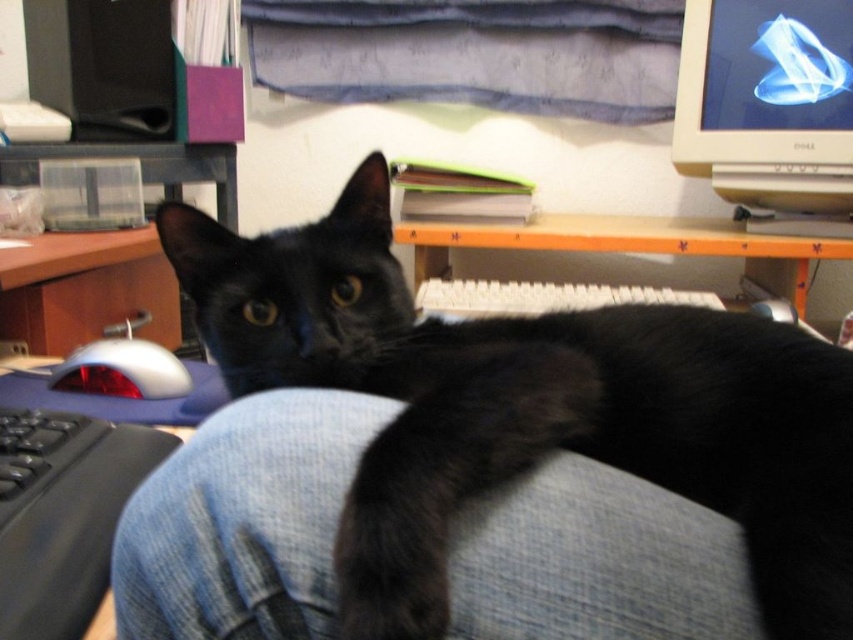
You are a photographer setting up a shot of the scene. You need to decide whether to adjust the lighting to highlight the black fur tail at lower center or the matte silver monitor at upper right. Which object requires more attention to avoid being lost in the background due to its size?

The black fur tail at lower center requires more attention because it is thinner than the matte silver monitor at upper right, making it potentially harder to see against the background.

You are trying to determine if the black fur tail at lower center can be seen from the matte silver monitor at upper right. Based on their sizes, is it possible?

The black fur tail at lower center is smaller than the matte silver monitor at upper right. Since the tail is smaller, it might be possible to see it from the monitor if positioned within the monitor screen, but size alone doesn